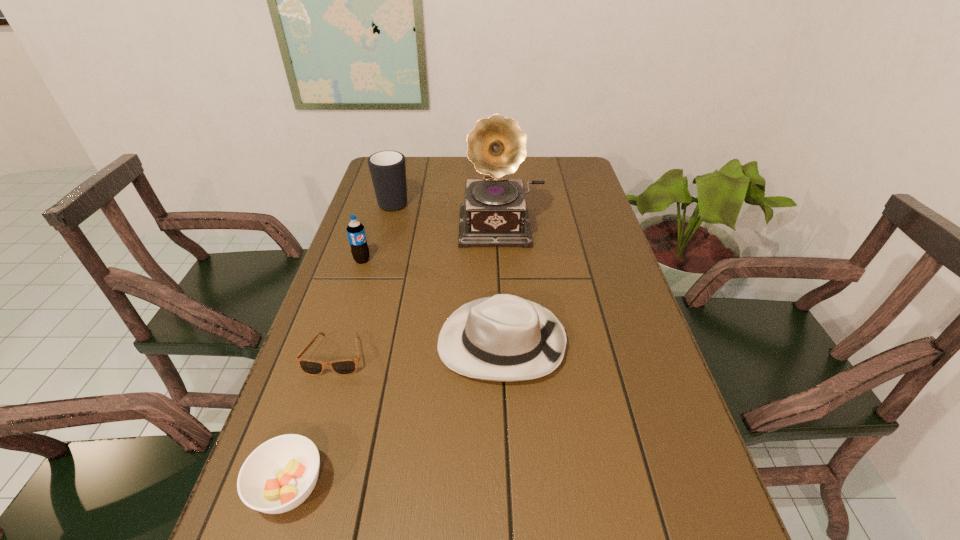
Find the location of a particular element. The width and height of the screenshot is (960, 540). empty space between the mug and the sunglasses is located at coordinates (365, 278).

Find the location of `free space between the sunglasses and the soda bottle`. free space between the sunglasses and the soda bottle is located at coordinates (348, 308).

Locate an element on the screen. This screenshot has width=960, height=540. free space between the third farthest object and the mug is located at coordinates (378, 231).

Identify the location of vacant region between the shortest object and the tallest object. (420, 291).

Locate an element on the screen. The height and width of the screenshot is (540, 960). blank region between the tallest object and the mug is located at coordinates (448, 213).

At what (x,y) coordinates should I click in order to perform the action: click on free space between the tallest object and the fourth tallest object. Please return your answer as a coordinate pair (x, y). The height and width of the screenshot is (540, 960). Looking at the image, I should click on (502, 284).

Locate which object is the fifth closest to the tallest object. Please provide its 2D coordinates. Your answer should be formatted as a tuple, i.e. [(x, y)], where the tuple contains the x and y coordinates of a point satisfying the conditions above.

[(280, 474)]

You are a GUI agent. You are given a task and a screenshot of the screen. Output one action in this format:
    pyautogui.click(x=<x>, y=<y>)
    Task: Click on the fifth closest object to the second shortest object
    Image resolution: width=960 pixels, height=540 pixels.
    Given the screenshot: What is the action you would take?
    pyautogui.click(x=387, y=168)

Image resolution: width=960 pixels, height=540 pixels. I want to click on vacant space that satisfies the following two spatial constraints: 1. on the front-facing side of the third shortest object; 2. on the frames of the shortest object, so click(x=502, y=356).

At what (x,y) coordinates should I click in order to perform the action: click on free space that satisfies the following two spatial constraints: 1. on the horn of the tallest object; 2. on the front-facing side of the fourth tallest object. Please return your answer as a coordinate pair (x, y). The image size is (960, 540). Looking at the image, I should click on (511, 342).